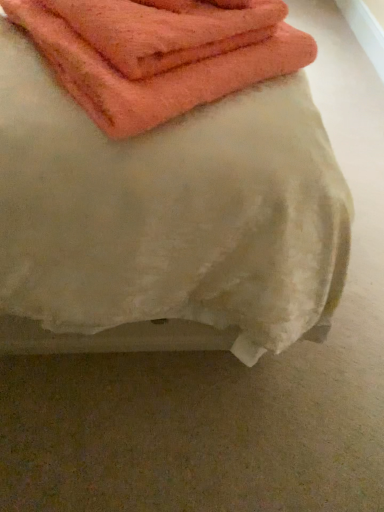
Locate an element on the screen. orange terry cloth towel at upper left, marked as the 2th towel in a front-to-back arrangement is located at coordinates (159, 75).

Which is correct: orange terry cloth towel at upper left, marked as the 2th towel in a front-to-back arrangement, is inside orange cotton towel at upper left, which is the first towel in front-to-back order, or outside of it?

orange terry cloth towel at upper left, marked as the 2th towel in a front-to-back arrangement, lies within the bounds of orange cotton towel at upper left, which is the first towel in front-to-back order.

From a real-world perspective, is orange terry cloth towel at upper left, the 2th towel from the back, physically above orange cotton towel at upper left, the third towel when ordered from back to front?

Correct, in the physical world, orange terry cloth towel at upper left, the 2th towel from the back, is higher than orange cotton towel at upper left, the third towel when ordered from back to front.

Which of these two, orange terry cloth towel at upper left, the 2th towel from the back, or orange cotton towel at upper left, the third towel when ordered from back to front, is thinner?

orange terry cloth towel at upper left, the 2th towel from the back, is thinner.

Is orange terry cloth towel at upper left, the 2th towel from the back, smaller than orange cotton towel at upper left, the third towel when ordered from back to front?

Yes, orange terry cloth towel at upper left, the 2th towel from the back, is smaller than orange cotton towel at upper left, the third towel when ordered from back to front.

From a real-world perspective, which is physically above, orange cotton towel at upper left, the third towel when ordered from back to front, or orange terry cloth towel at upper left, the 2th towel from the back?

orange terry cloth towel at upper left, the 2th towel from the back.

Where is `towel in front of the orange terry cloth towel at upper left, marked as the 2th towel in a front-to-back arrangement`? The height and width of the screenshot is (512, 384). towel in front of the orange terry cloth towel at upper left, marked as the 2th towel in a front-to-back arrangement is located at coordinates (166, 222).

How many degrees apart are the facing directions of orange cotton towel at upper left, the third towel when ordered from back to front, and orange terry cloth towel at upper left, the 2th towel from the back?

The angle between the facing direction of orange cotton towel at upper left, the third towel when ordered from back to front, and the facing direction of orange terry cloth towel at upper left, the 2th towel from the back, is 52 degrees.

Which is farther, (91,256) or (51,51)?

The point (91,256) is farther.

Could you tell me if orange terry cloth towel at upper left, marked as the 2th towel in a front-to-back arrangement, is facing orange terry cloth towel at upper left, acting as the 1th towel starting from the back?

No, orange terry cloth towel at upper left, marked as the 2th towel in a front-to-back arrangement, does not turn towards orange terry cloth towel at upper left, acting as the 1th towel starting from the back.

Does orange terry cloth towel at upper left, the 2th towel from the back, come in front of orange terry cloth towel at upper left, acting as the 1th towel starting from the back?

Yes, it is.

Between orange terry cloth towel at upper left, the 2th towel from the back, and orange terry cloth towel at upper left, acting as the 1th towel starting from the back, which one has more height?

Standing taller between the two is orange terry cloth towel at upper left, the 2th towel from the back.

Based on the photo, measure the distance from orange terry cloth towel at upper left, acting as the 1th towel starting from the back, to orange cotton towel at upper left, which is the first towel in front-to-back order.

11.88 inches.

Between orange terry cloth towel at upper left, the third towel from the front, and orange cotton towel at upper left, which is the first towel in front-to-back order, which one appears on the right side from the viewer's perspective?

From the viewer's perspective, orange cotton towel at upper left, which is the first towel in front-to-back order, appears more on the right side.

From the image's perspective, starting from the orange cotton towel at upper left, which is the first towel in front-to-back order, which towel is the 2nd one above? Please provide its 2D coordinates.

[(165, 30)]

Is orange terry cloth towel at upper left, the third towel from the front, bigger or smaller than orange cotton towel at upper left, the third towel when ordered from back to front?

In the image, orange terry cloth towel at upper left, the third towel from the front, appears to be smaller than orange cotton towel at upper left, the third towel when ordered from back to front.

From a real-world perspective, between orange terry cloth towel at upper left, acting as the 1th towel starting from the back, and orange terry cloth towel at upper left, the 2th towel from the back, who is vertically lower?

orange terry cloth towel at upper left, the 2th towel from the back, is physically lower.

I want to click on towel on the left of orange terry cloth towel at upper left, the third towel from the front, so click(159, 75).

Relative to orange terry cloth towel at upper left, marked as the 2th towel in a front-to-back arrangement, is orange terry cloth towel at upper left, acting as the 1th towel starting from the back, in front or behind?

Clearly, orange terry cloth towel at upper left, acting as the 1th towel starting from the back, is behind orange terry cloth towel at upper left, marked as the 2th towel in a front-to-back arrangement.

Which object is positioned more to the right, orange terry cloth towel at upper left, acting as the 1th towel starting from the back, or orange terry cloth towel at upper left, the 2th towel from the back?

From the viewer's perspective, orange terry cloth towel at upper left, acting as the 1th towel starting from the back, appears more on the right side.

From a real-world perspective, is orange cotton towel at upper left, which is the first towel in front-to-back order, above or below orange terry cloth towel at upper left, the third towel from the front?

From a real-world perspective, orange cotton towel at upper left, which is the first towel in front-to-back order, is physically below orange terry cloth towel at upper left, the third towel from the front.

Considering the relative positions of orange cotton towel at upper left, the third towel when ordered from back to front, and orange terry cloth towel at upper left, acting as the 1th towel starting from the back, in the image provided, is orange cotton towel at upper left, the third towel when ordered from back to front, to the left of orange terry cloth towel at upper left, acting as the 1th towel starting from the back, from the viewer's perspective?

No, orange cotton towel at upper left, the third towel when ordered from back to front, is not to the left of orange terry cloth towel at upper left, acting as the 1th towel starting from the back.

Based on the photo, which of these two, orange cotton towel at upper left, the third towel when ordered from back to front, or orange terry cloth towel at upper left, acting as the 1th towel starting from the back, is bigger?

Bigger between the two is orange cotton towel at upper left, the third towel when ordered from back to front.

Identify the location of towel directly beneath the orange terry cloth towel at upper left, marked as the 2th towel in a front-to-back arrangement (from a real-world perspective). This screenshot has width=384, height=512. (166, 222).

Where is `the 2nd towel counting from the left side of the orange cotton towel at upper left, the third towel when ordered from back to front`? This screenshot has height=512, width=384. the 2nd towel counting from the left side of the orange cotton towel at upper left, the third towel when ordered from back to front is located at coordinates (159, 75).

Considering their positions, is orange terry cloth towel at upper left, acting as the 1th towel starting from the back, positioned further to orange cotton towel at upper left, the third towel when ordered from back to front, than orange terry cloth towel at upper left, marked as the 2th towel in a front-to-back arrangement?

orange terry cloth towel at upper left, acting as the 1th towel starting from the back, is further to orange cotton towel at upper left, the third towel when ordered from back to front.

Estimate the real-world distances between objects in this image. Which object is further from orange terry cloth towel at upper left, the 2th towel from the back, orange cotton towel at upper left, the third towel when ordered from back to front, or orange terry cloth towel at upper left, the third towel from the front?

orange cotton towel at upper left, the third towel when ordered from back to front, is positioned further to the anchor orange terry cloth towel at upper left, the 2th towel from the back.

When comparing their distances from orange cotton towel at upper left, the third towel when ordered from back to front, does orange terry cloth towel at upper left, the 2th towel from the back, or orange terry cloth towel at upper left, the third towel from the front, seem further?

orange terry cloth towel at upper left, the third towel from the front, is further to orange cotton towel at upper left, the third towel when ordered from back to front.

Looking at the image, which one is located closer to orange terry cloth towel at upper left, acting as the 1th towel starting from the back, orange terry cloth towel at upper left, the 2th towel from the back, or orange cotton towel at upper left, which is the first towel in front-to-back order?

Based on the image, orange terry cloth towel at upper left, the 2th towel from the back, appears to be nearer to orange terry cloth towel at upper left, acting as the 1th towel starting from the back.

Based on their spatial positions, is orange terry cloth towel at upper left, the third towel from the front, or orange cotton towel at upper left, which is the first towel in front-to-back order, further from orange terry cloth towel at upper left, marked as the 2th towel in a front-to-back arrangement?

orange cotton towel at upper left, which is the first towel in front-to-back order, is further to orange terry cloth towel at upper left, marked as the 2th towel in a front-to-back arrangement.

Based on their spatial positions, is orange cotton towel at upper left, which is the first towel in front-to-back order, or orange terry cloth towel at upper left, the 2th towel from the back, closer to orange terry cloth towel at upper left, the third towel from the front?

orange terry cloth towel at upper left, the 2th towel from the back, is closer to orange terry cloth towel at upper left, the third towel from the front.

Where is `towel located between orange cotton towel at upper left, the third towel when ordered from back to front, and orange terry cloth towel at upper left, the third towel from the front, in the depth direction`? towel located between orange cotton towel at upper left, the third towel when ordered from back to front, and orange terry cloth towel at upper left, the third towel from the front, in the depth direction is located at coordinates (159, 75).